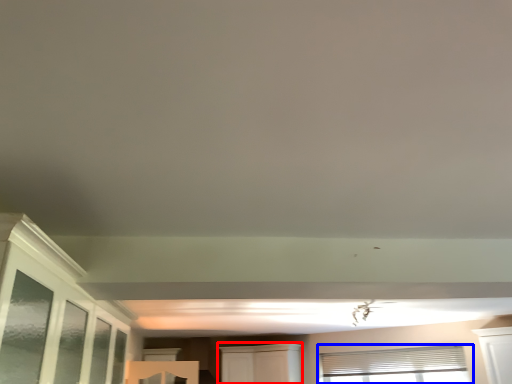
Question: Which object appears farthest to the camera in this image, cabinetry (highlighted by a red box) or window (highlighted by a blue box)?

Choices:
 (A) cabinetry
 (B) window

Answer: (A)